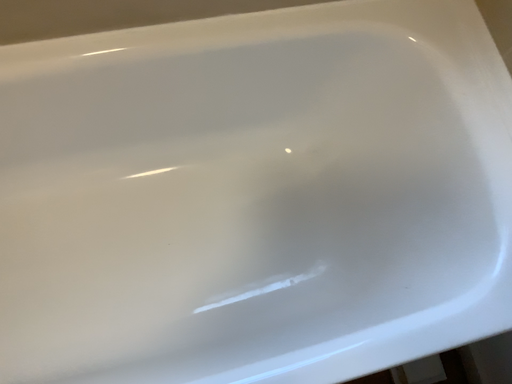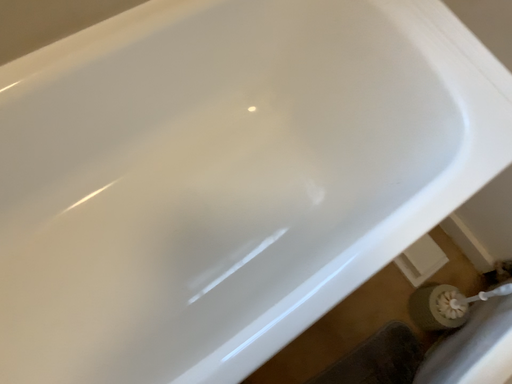
Question: Which way did the camera rotate in the video?

Choices:
 (A) rotated left
 (B) rotated right

Answer: (B)